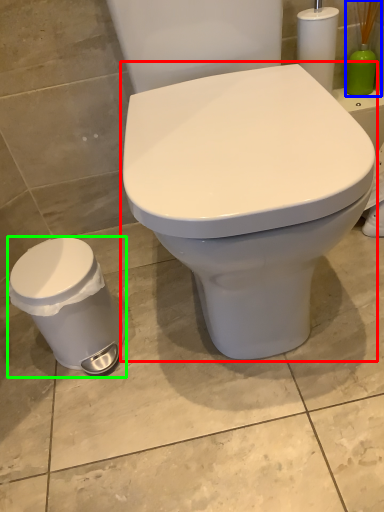
Question: Estimate the real-world distances between objects in this image. Which object is closer to toilet (highlighted by a red box), brush (highlighted by a blue box) or porcelain (highlighted by a green box)?

Choices:
 (A) brush
 (B) porcelain

Answer: (B)